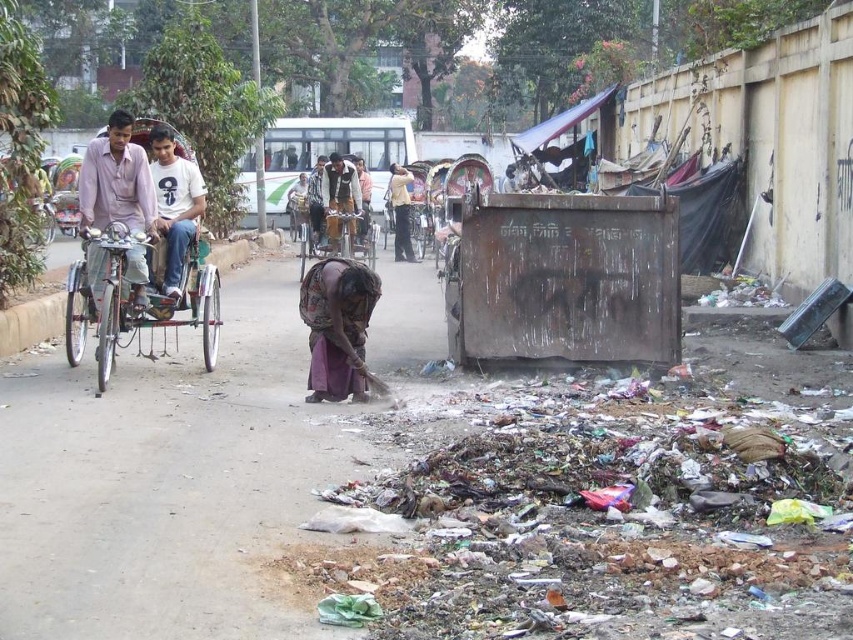
In the scene shown: You are a tailor who needs to determine which clothing item requires more fabric. Based on the scene, which item would need more fabric, the light pink cotton shirt at left or the dark brown leather jacket at center?

The dark brown leather jacket at center requires more fabric because its width is greater than the light pink cotton shirt at left.

You are a delivery person needing to pass through the street where the metallic silver rickshaw at left and the light pink cotton shirt at left are located. The path is narrow. Can your 1.2 meter wide delivery cart fit between them?

The metallic silver rickshaw at left is wider than the light pink cotton shirt at left. Since the path is narrow, the delivery cart may not fit if the combined width of both objects exceeds 1.2 meters. However, without exact measurements, it is uncertain. The description only states the rickshaw is wider than the shirt, but not by how much.